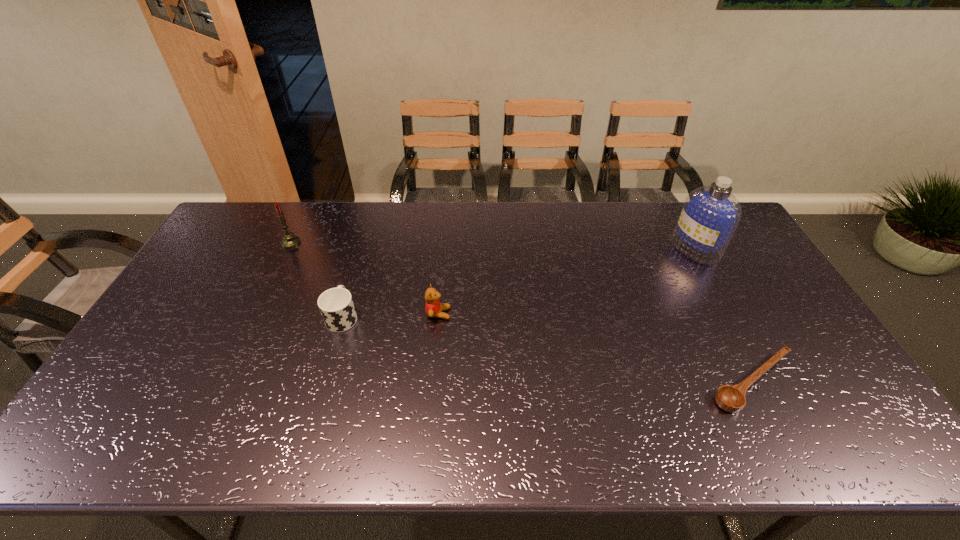
Image resolution: width=960 pixels, height=540 pixels. I want to click on object located in the far right corner section of the desktop, so click(x=710, y=214).

At what (x,y) coordinates should I click in order to perform the action: click on vacant space at the far edge. Please return your answer as a coordinate pair (x, y). This screenshot has height=540, width=960. Looking at the image, I should click on 516,206.

The height and width of the screenshot is (540, 960). Find the location of `vacant space at the near edge of the desktop`. vacant space at the near edge of the desktop is located at coordinates [710, 429].

This screenshot has width=960, height=540. In the image, there is a desktop. What are the coordinates of `blank space at the left edge` in the screenshot? It's located at (156, 370).

I want to click on vacant area at the right edge, so click(x=754, y=286).

What are the coordinates of `free region at the near left corner of the desktop` in the screenshot? It's located at (114, 448).

Identify the location of vacant area that lies between the shortest object and the cleansing agent. The image size is (960, 540). (724, 315).

You are a GUI agent. You are given a task and a screenshot of the screen. Output one action in this format:
    pyautogui.click(x=<x>, y=<y>)
    Task: Click on the vacant space that is in between the cleansing agent and the nearest object
    
    Given the screenshot: What is the action you would take?
    pyautogui.click(x=724, y=315)

The image size is (960, 540). What are the coordinates of `vacant point located between the third shortest object and the cup` in the screenshot? It's located at (391, 315).

Locate an element on the screen. The image size is (960, 540). free spot between the leftmost object and the wooden spoon is located at coordinates (522, 313).